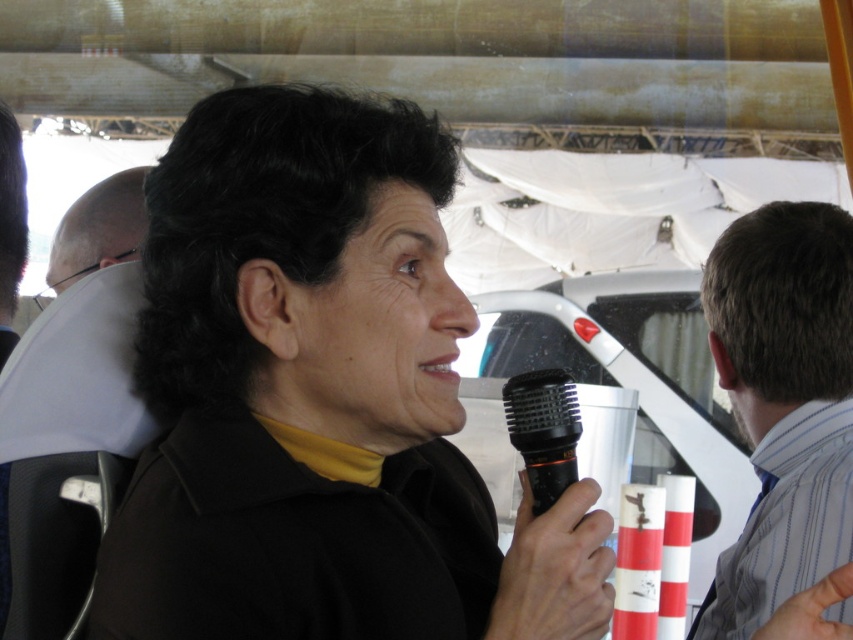
Does black matte shirt at center have a smaller size compared to bald head at upper left?

Yes.

Can you confirm if black matte shirt at center is taller than bald head at upper left?

Yes.

Is point (300, 260) more distant than point (111, 180)?

No, (300, 260) is in front of (111, 180).

The height and width of the screenshot is (640, 853). I want to click on black matte shirt at center, so click(320, 401).

Is gray striped shirt at right shorter than matte black microphone at left?

No, gray striped shirt at right is not shorter than matte black microphone at left.

Is gray striped shirt at right positioned at the back of matte black microphone at left?

No, gray striped shirt at right is closer to the viewer.

Who is more forward, (793, 547) or (20, 147)?

Positioned in front is point (20, 147).

You are a GUI agent. You are given a task and a screenshot of the screen. Output one action in this format:
    pyautogui.click(x=<x>, y=<y>)
    Task: Click on the gray striped shirt at right
    The image size is (853, 640).
    Given the screenshot: What is the action you would take?
    pyautogui.click(x=782, y=403)

Who is more distant from viewer, (254, 632) or (805, 273)?

Point (805, 273)

Is point (233, 260) closer to camera compared to point (788, 577)?

Yes, it is in front of point (788, 577).

Is point (541, 520) positioned before point (802, 356)?

That is True.

The width and height of the screenshot is (853, 640). I want to click on black matte shirt at center, so click(x=320, y=401).